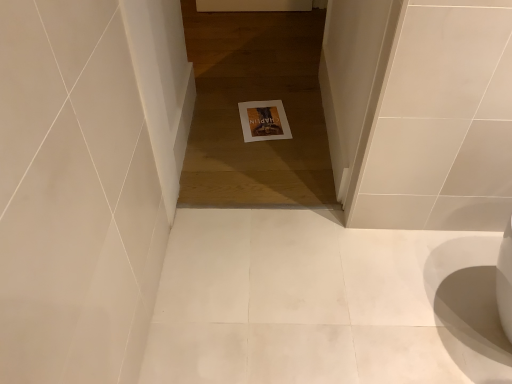
Locate an element on the screen. The width and height of the screenshot is (512, 384). free location to the right of white paper at center is located at coordinates (304, 117).